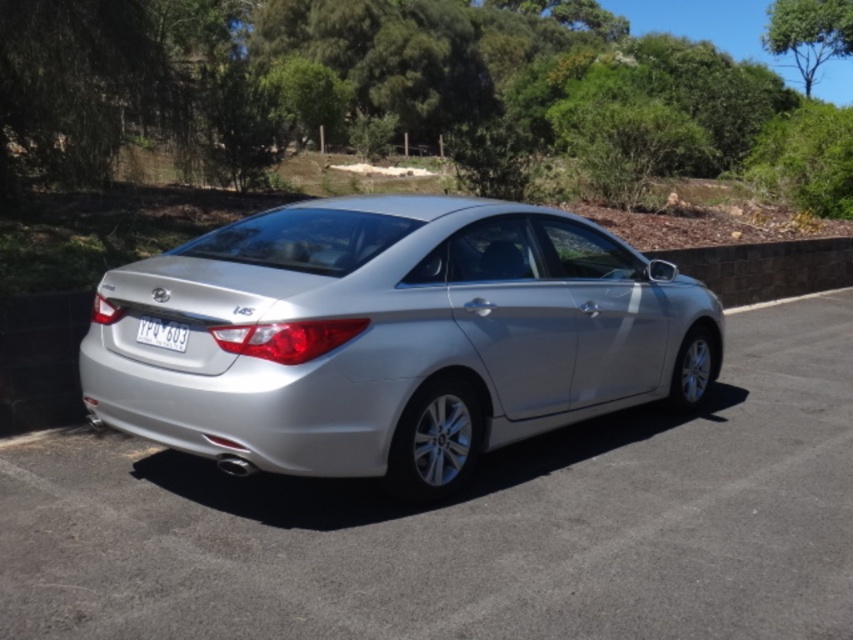
You are standing at the point labeled point [166,333] and want to walk towards the silver Hyundai i45 sedan parked at an angle. Is the point labeled point [369,432] located in front of or behind the car relative to your current position?

The point labeled point [369,432] is in front of the silver Hyundai i45 sedan relative to your current position at point [166,333] because the point [369,432] is in front of point [166,333].

In the scene shown: You are standing at the origin point of a coordinate system where the image is mapped. The silver metallic car at center is located at point 0.822, 0.553. If you need to move towards the car from your current position at the origin, which direction should you move in terms of the coordinate system?

To move towards the silver metallic car at center located at coordinates (471,525) from the origin, you should move in the positive x and positive y direction since both coordinates are greater than zero.